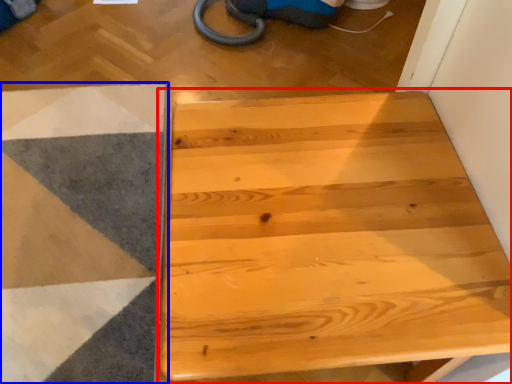
Question: Which object is closer to the camera taking this photo, table (highlighted by a red box) or ramp (highlighted by a blue box)?

Choices:
 (A) table
 (B) ramp

Answer: (A)